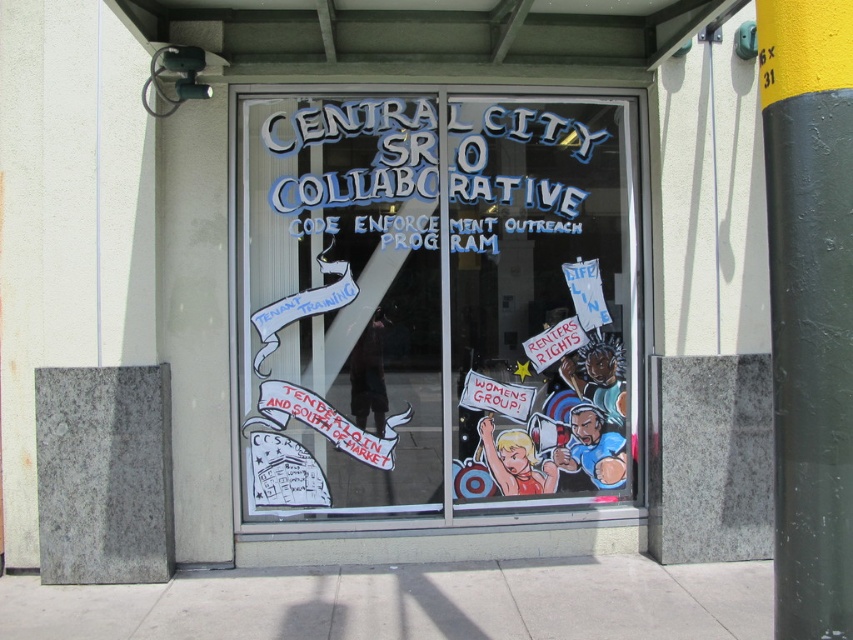
Consider the image. Which of these two, transparent glass window at center or yellow-green painted pole at right, stands taller?

With more height is transparent glass window at center.

Between point (618, 374) and point (781, 161), which one is positioned in front?

Point (781, 161) is in front.

Does point (299, 440) come behind point (802, 268)?

Yes.

In order to click on transparent glass window at center in this screenshot , I will do `click(434, 304)`.